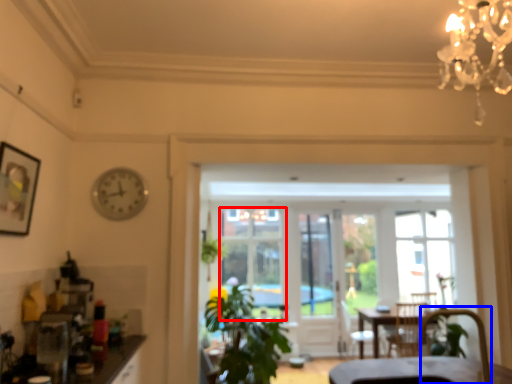
Question: Which point is closer to the camera, window (highlighted by a red box) or armchair (highlighted by a blue box)?

Choices:
 (A) window
 (B) armchair

Answer: (B)